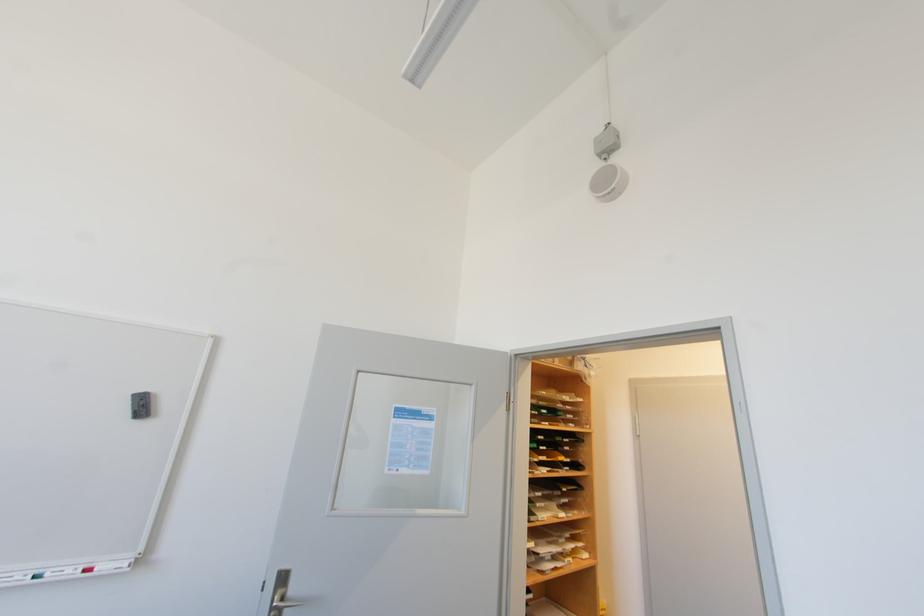
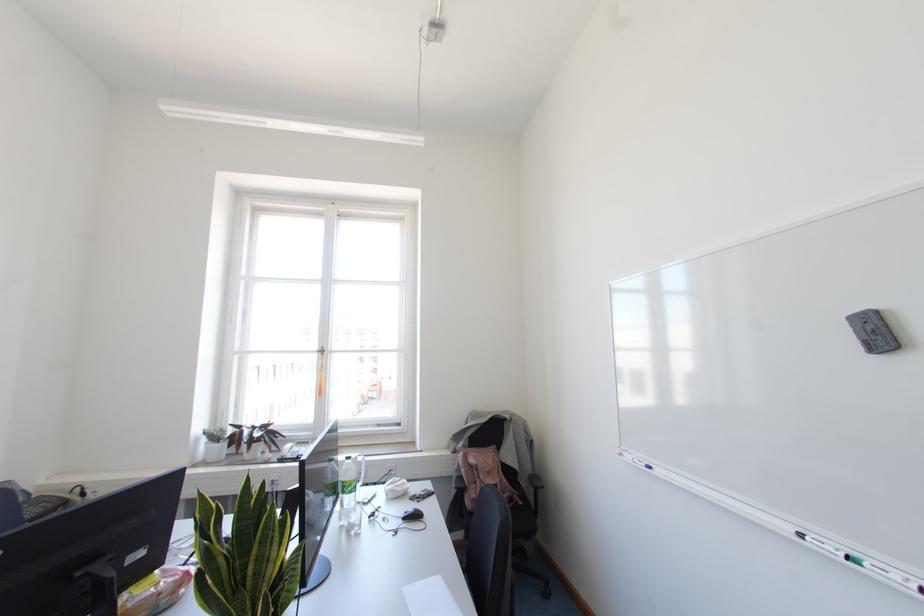
Where in the second image is the point corresponding to pixel 45 575 from the first image?

(866, 565)